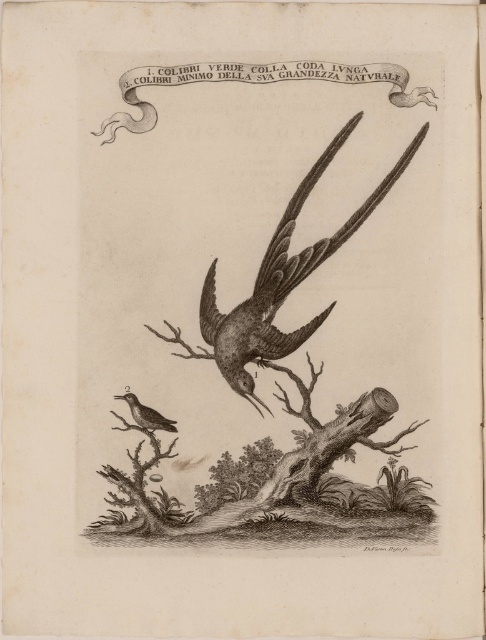
Question: Does gray textured bird at center have a smaller size compared to brown wood grain bird at lower left?

Choices:
 (A) no
 (B) yes

Answer: (A)

Question: Which of the following is the farthest from the observer?

Choices:
 (A) (414, 499)
 (B) (134, 410)
 (C) (278, 333)

Answer: (C)

Question: Can you confirm if smooth wood tree trunk at lower center is positioned above gray textured bird at center?

Choices:
 (A) no
 (B) yes

Answer: (A)

Question: Does smooth wood tree trunk at lower center have a smaller size compared to brown wood grain bird at lower left?

Choices:
 (A) yes
 (B) no

Answer: (B)

Question: Which of these objects is positioned closest to the brown wood grain bird at lower left?

Choices:
 (A) gray textured bird at center
 (B) smooth wood tree trunk at lower center

Answer: (B)

Question: Which object is the farthest from the smooth wood tree trunk at lower center?

Choices:
 (A) brown wood grain bird at lower left
 (B) gray textured bird at center

Answer: (A)